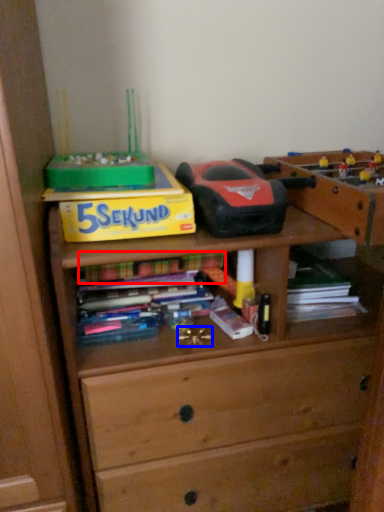
Question: Which point is closer to the camera, book (highlighted by a red box) or toy (highlighted by a blue box)?

Choices:
 (A) book
 (B) toy

Answer: (B)